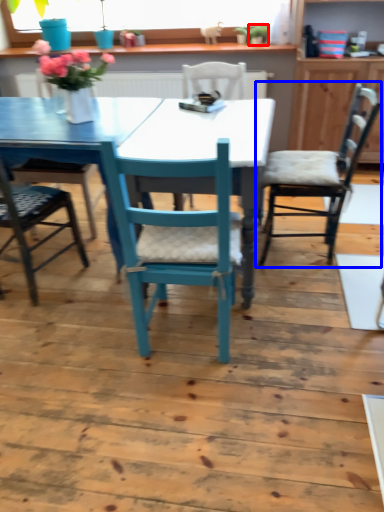
Question: Which of the following is the closest to the observer, houseplant (highlighted by a red box) or chair (highlighted by a blue box)?

Choices:
 (A) houseplant
 (B) chair

Answer: (B)